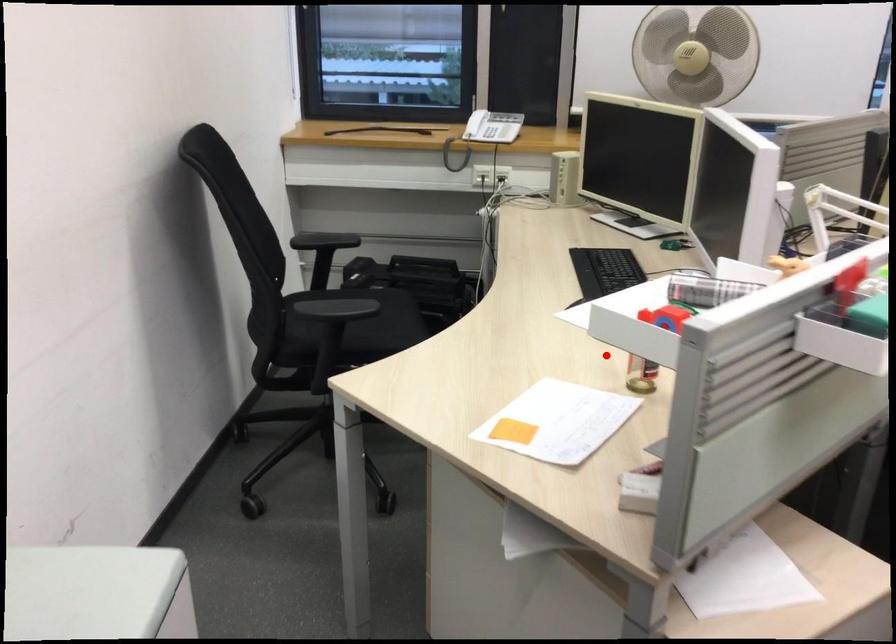
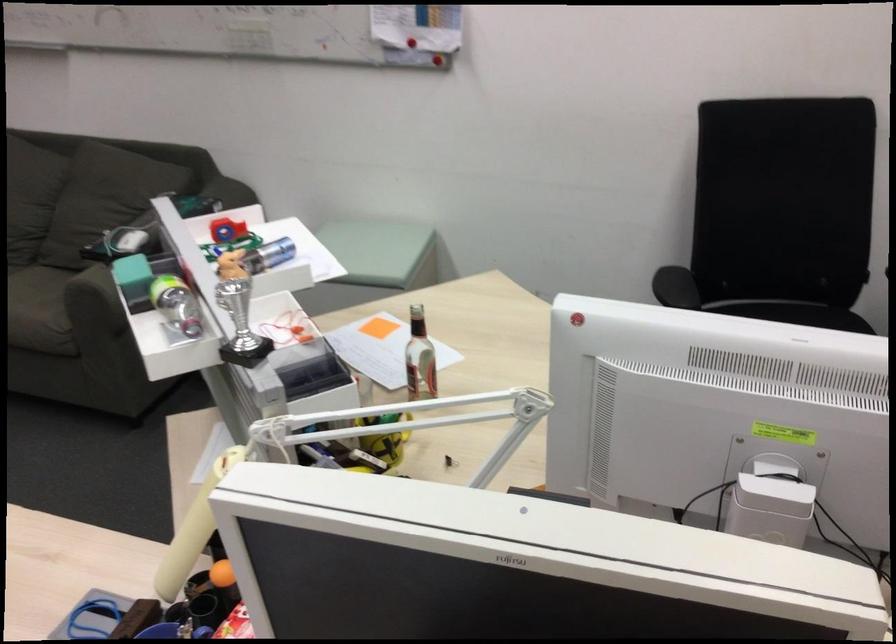
Where in the second image is the point corresponding to the highlighted location from the first image?

(419, 359)